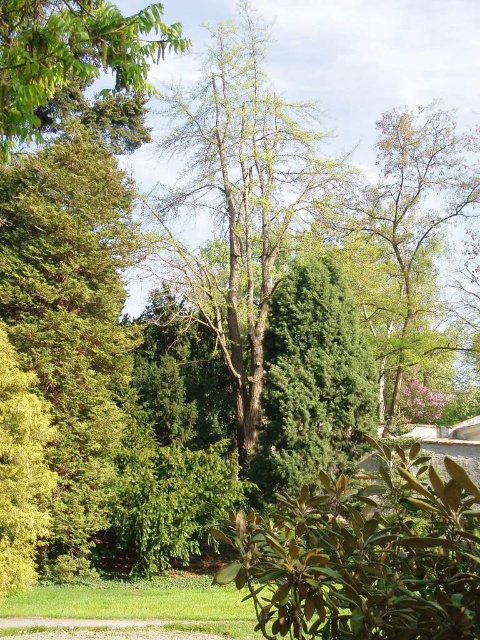
You are standing in the serene outdoor scene described. You need to locate the green leathery leaves at lower center. According to their position, where exactly would you find them relative to the other elements in the scene?

The green leathery leaves at lower center are positioned at coordinates point (x=363, y=554), which places them near the lower central area of the scene, close to the foreground among the variety of plants and trees mentioned in the scene description.

Based on the photo, you are planning to plant a new tree in your garden. You have two options based on the image provided. The first is the green leafy tree at center, and the second is the green leafy tree at upper right. Which tree would you choose if you want a larger tree in your garden?

The green leafy tree at center is larger than the green leafy tree at upper right, so you should choose the green leafy tree at center if you want a larger tree in your garden.